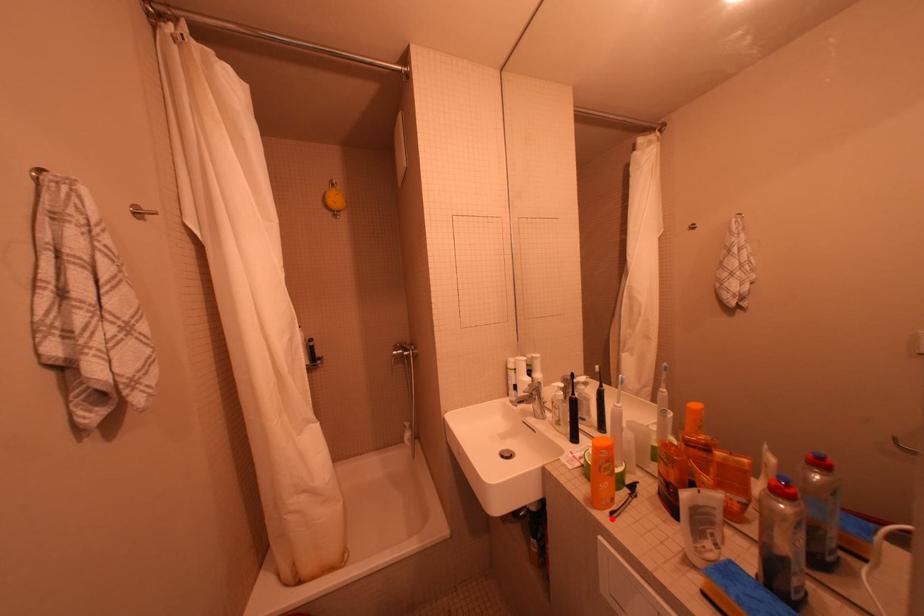
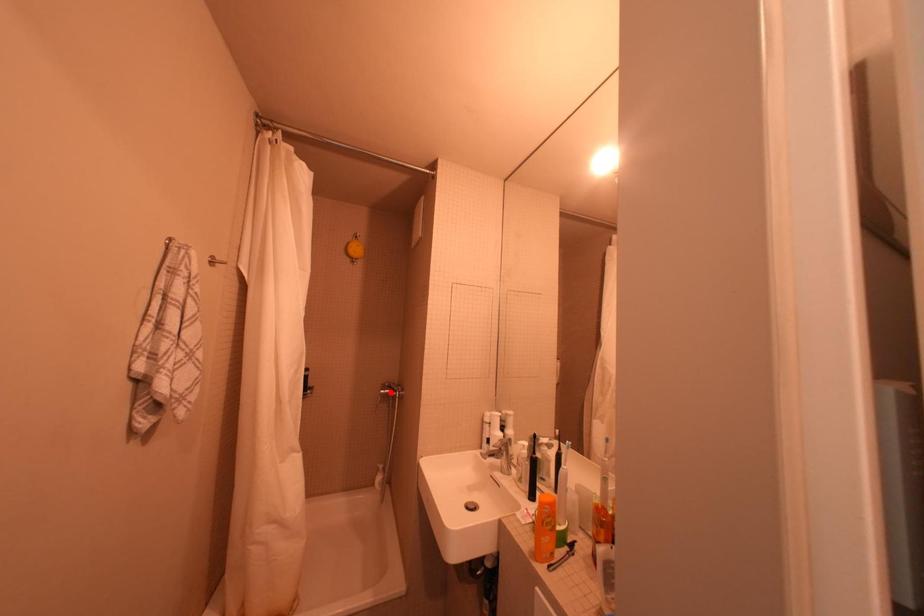
I am providing you with two images of the same scene from different viewpoints. A red point is marked on the first image and another point is marked on the second image. Are the points marked in image1 and image2 representing the same 3D position?

No